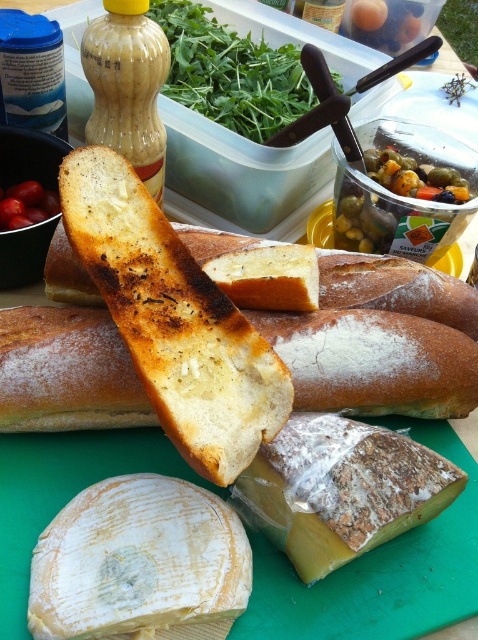
Is white crumbly cheese at center wider than green olive at upper right?

In fact, white crumbly cheese at center might be narrower than green olive at upper right.

Which of these two, white crumbly cheese at center or green olive at upper right, stands shorter?

white crumbly cheese at center is shorter.

Does point (75, 577) come behind point (469, 220)?

No, it is in front of (469, 220).

The height and width of the screenshot is (640, 478). I want to click on white crumbly cheese at center, so click(x=139, y=561).

Describe the element at coordinates (173, 320) in the screenshot. I see `brown crusty bread at center` at that location.

Between brown crusty bread at center and green leafy vegetable at upper center, which one appears on the left side from the viewer's perspective?

brown crusty bread at center is more to the left.

At what (x,y) coordinates should I click in order to perform the action: click on brown crusty bread at center. Please return your answer as a coordinate pair (x, y). This screenshot has height=640, width=478. Looking at the image, I should click on (173, 320).

Who is more distant from viewer, (234, 314) or (380, 460)?

Positioned behind is point (234, 314).

Between point (133, 234) and point (261, 496), which one is positioned behind?

Point (133, 234)

The width and height of the screenshot is (478, 640). Identify the location of brown crusty bread at center. (173, 320).